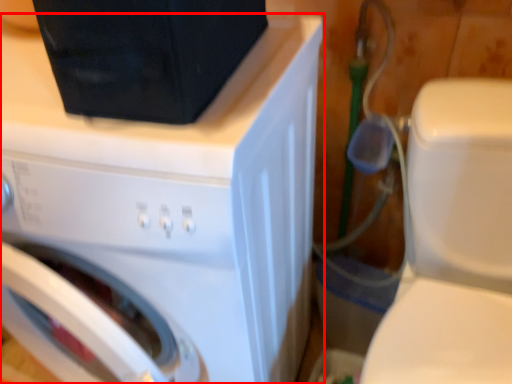
Question: From the image, what is the correct spatial relationship of washing machine (annotated by the red box) in relation to washer?

Choices:
 (A) right
 (B) left

Answer: (B)